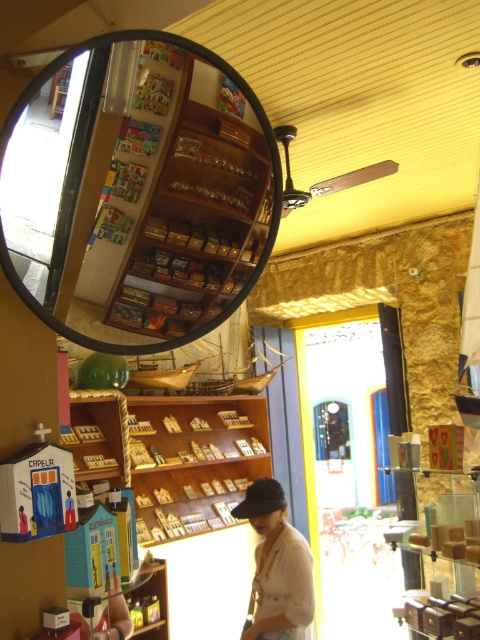
Question: Is wooden houses at center wider than wooden shelves at center?

Choices:
 (A) no
 (B) yes

Answer: (B)

Question: Which of these objects is positioned farthest from the black fabric baseball cap at center?

Choices:
 (A) wooden shelves at center
 (B) wooden houses at center
 (C) white cotton shirt at lower center

Answer: (A)

Question: Which object is farther from the camera taking this photo?

Choices:
 (A) black fabric baseball cap at center
 (B) white cotton shirt at lower center

Answer: (A)

Question: Can you confirm if wooden shelves at center is thinner than white cotton shirt at lower center?

Choices:
 (A) no
 (B) yes

Answer: (A)

Question: Which point appears closest to the camera in this image?

Choices:
 (A) (197, 492)
 (B) (256, 97)

Answer: (B)

Question: Is the position of wooden shelves at center more distant than that of black fabric baseball cap at center?

Choices:
 (A) yes
 (B) no

Answer: (B)